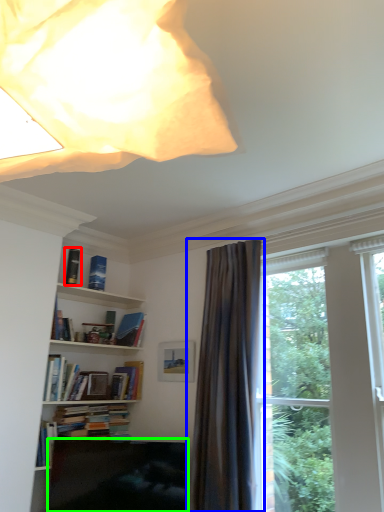
Question: Which is farther away from book (highlighted by a red box)? curtain (highlighted by a blue box) or furniture (highlighted by a green box)?

Choices:
 (A) curtain
 (B) furniture

Answer: (A)